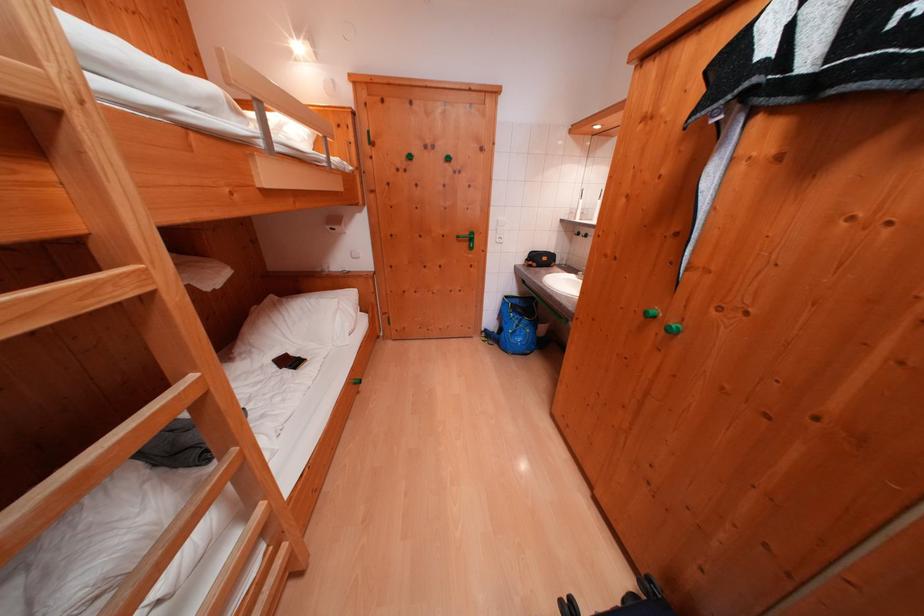
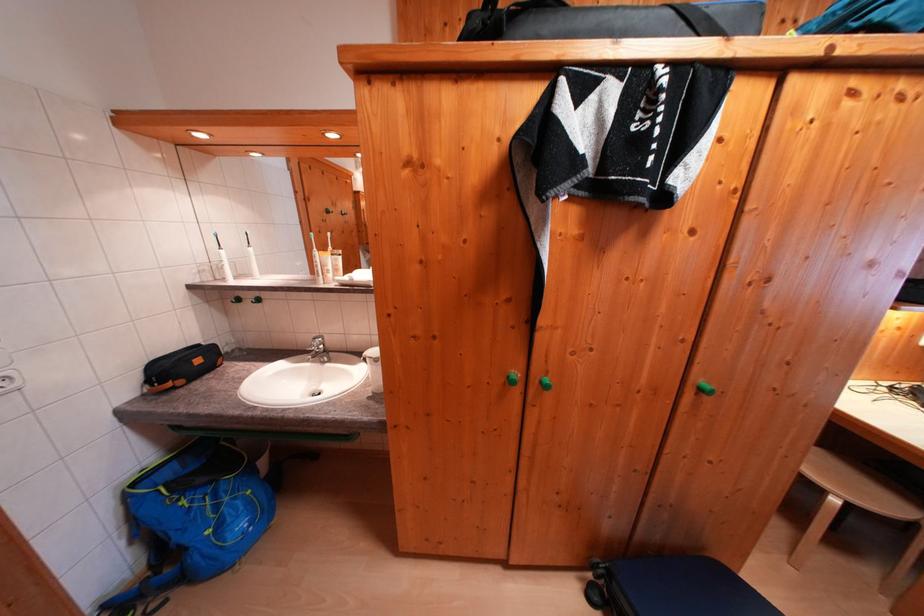
In the second image, find the point that corresponds to (515,301) in the first image.

(142, 488)